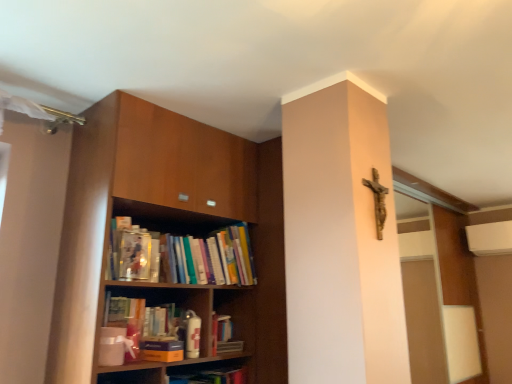
Question: Is blue matte paperback book at lower center far from wooden bookshelf at left?

Choices:
 (A) no
 (B) yes

Answer: (A)

Question: Does blue matte paperback book at lower center appear on the left side of wooden bookshelf at left?

Choices:
 (A) no
 (B) yes

Answer: (A)

Question: Is blue matte paperback book at lower center behind wooden bookshelf at left?

Choices:
 (A) yes
 (B) no

Answer: (A)

Question: Can you confirm if blue matte paperback book at lower center is bigger than wooden bookshelf at left?

Choices:
 (A) no
 (B) yes

Answer: (A)

Question: From the image's perspective, would you say blue matte paperback book at lower center is shown under wooden bookshelf at left?

Choices:
 (A) no
 (B) yes

Answer: (B)

Question: Is blue matte paperback book at lower center closer to camera compared to wooden bookshelf at left?

Choices:
 (A) yes
 (B) no

Answer: (B)

Question: Is wooden bookshelf at left in front of blue matte paperback book at lower center?

Choices:
 (A) no
 (B) yes

Answer: (B)

Question: Does wooden bookshelf at left contain blue matte paperback book at lower center?

Choices:
 (A) no
 (B) yes

Answer: (B)

Question: Is wooden bookshelf at left behind blue matte paperback book at lower center?

Choices:
 (A) yes
 (B) no

Answer: (B)

Question: Is wooden bookshelf at left positioned beyond the bounds of blue matte paperback book at lower center?

Choices:
 (A) yes
 (B) no

Answer: (A)

Question: Is wooden bookshelf at left bigger than blue matte paperback book at lower center?

Choices:
 (A) no
 (B) yes

Answer: (B)

Question: Is blue matte paperback book at lower center at the back of wooden bookshelf at left?

Choices:
 (A) yes
 (B) no

Answer: (A)

Question: Is blue matte paperback book at lower center spatially inside wooden bookshelf at left, or outside of it?

Choices:
 (A) outside
 (B) inside

Answer: (B)